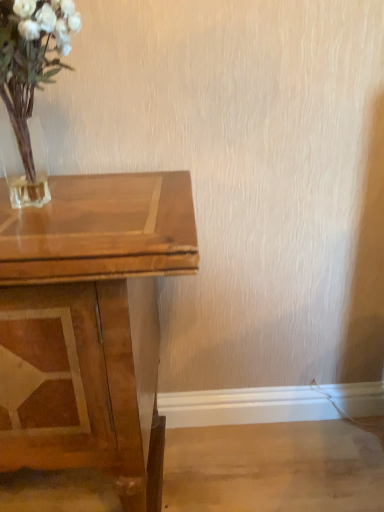
Locate an element on the screen. free region under translucent glass vase at upper left (from a real-world perspective) is located at coordinates (38, 206).